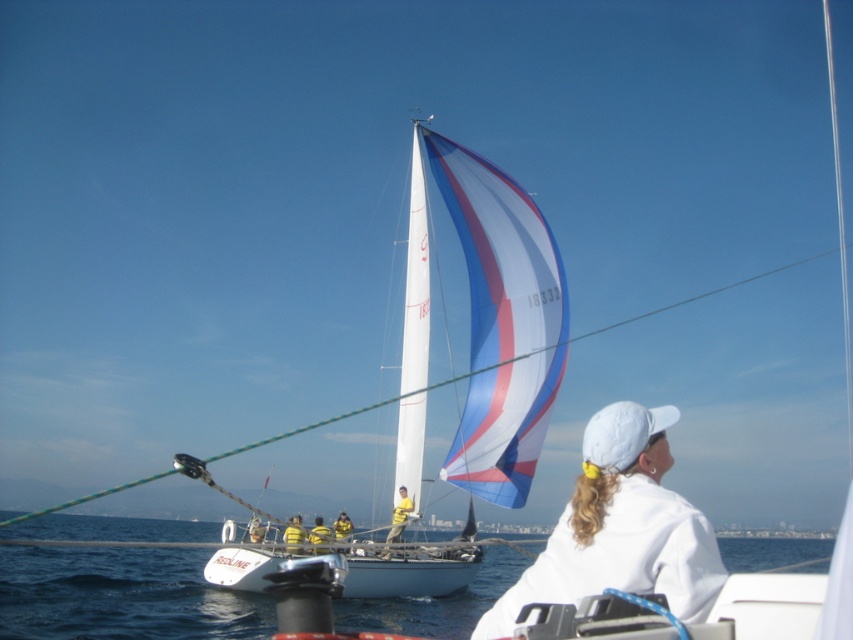
Does white matte baseball cap at upper center have a greater height compared to yellow fabric shirt at center?

Correct, white matte baseball cap at upper center is much taller as yellow fabric shirt at center.

Where is `white matte baseball cap at upper center`? This screenshot has height=640, width=853. white matte baseball cap at upper center is located at coordinates (619, 528).

Can you confirm if white sail at center is taller than blue water at lower center?

In fact, white sail at center may be shorter than blue water at lower center.

This screenshot has height=640, width=853. What are the coordinates of `white sail at center` in the screenshot? It's located at (485, 324).

Where is `white sail at center`? Image resolution: width=853 pixels, height=640 pixels. white sail at center is located at coordinates (485, 324).

Who is lower down, blue water at lower center or yellow fabric shirt at center?

blue water at lower center

Measure the distance from blue water at lower center to yellow fabric shirt at center.

blue water at lower center is 24.64 meters away from yellow fabric shirt at center.

Which is in front, point (119, 605) or point (403, 499)?

Point (403, 499) is more forward.

Identify the location of blue water at lower center. (120, 595).